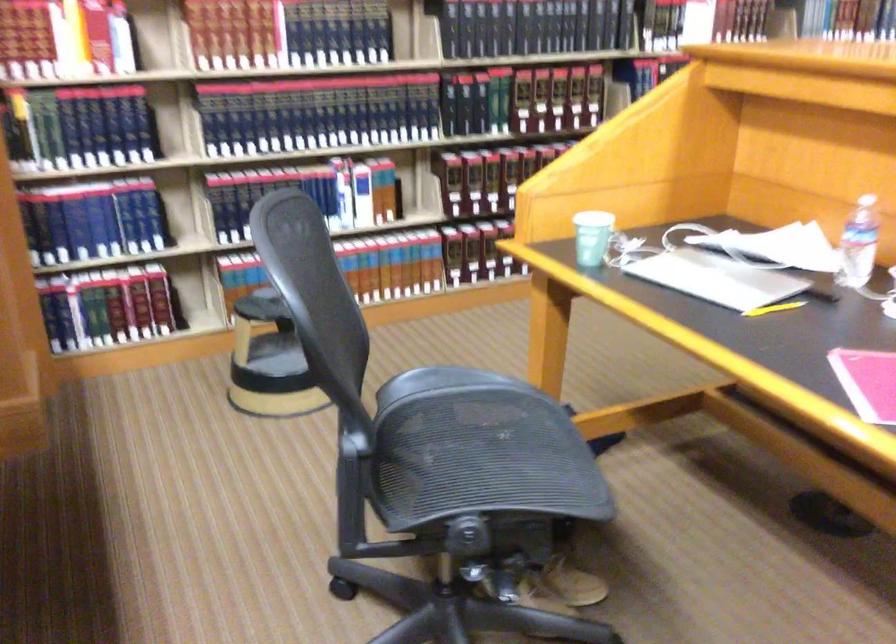
Where would you sit the chair sitting surface? Please return your answer as a coordinate pair (x, y).

(470, 442)